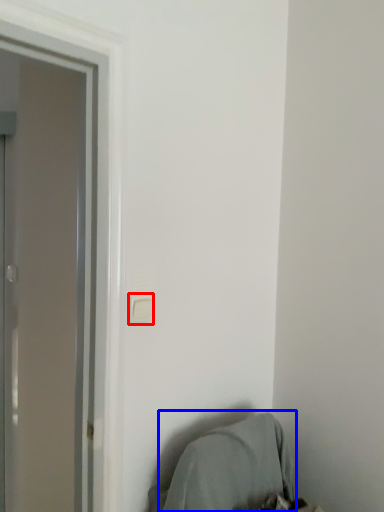
Question: Which object appears farthest to the camera in this image, light switch (highlighted by a red box) or bean bag chair (highlighted by a blue box)?

Choices:
 (A) light switch
 (B) bean bag chair

Answer: (A)